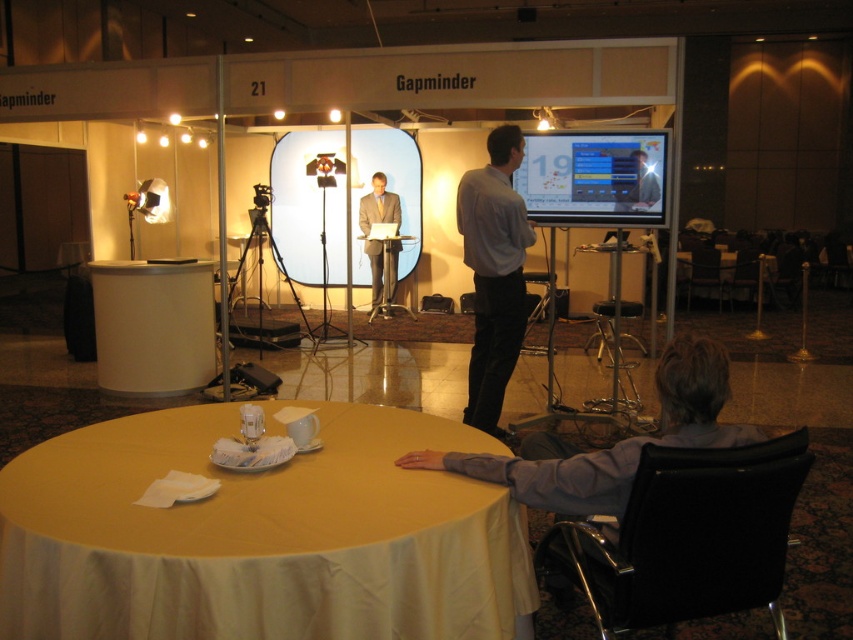
Does matte gray suit at center have a smaller size compared to matte black laptop at upper center?

Actually, matte gray suit at center might be larger than matte black laptop at upper center.

Does matte gray suit at center appear on the left side of matte black laptop at upper center?

Correct, you'll find matte gray suit at center to the left of matte black laptop at upper center.

At what (x,y) coordinates should I click in order to perform the action: click on matte gray suit at center. Please return your answer as a coordinate pair (x, y). The width and height of the screenshot is (853, 640). Looking at the image, I should click on (381, 268).

Where is `matte gray suit at center`? The height and width of the screenshot is (640, 853). matte gray suit at center is located at coordinates (381, 268).

Between yellow fabric-covered table at lower left and light blue shirt at center, which one has less height?

With less height is yellow fabric-covered table at lower left.

Does yellow fabric-covered table at lower left have a greater height compared to light blue shirt at center?

No, yellow fabric-covered table at lower left is not taller than light blue shirt at center.

Is point (521, 545) positioned behind point (503, 129)?

That is False.

In order to click on yellow fabric-covered table at lower left in this screenshot , I will do `click(259, 536)`.

Does matte plastic screen at upper center lie behind matte black laptop at upper center?

That is False.

Between matte plastic screen at upper center and matte black laptop at upper center, which one appears on the left side from the viewer's perspective?

Positioned to the left is matte plastic screen at upper center.

Does point (639, 138) come farther from viewer compared to point (637, 204)?

No, it is not.

Identify the location of matte plastic screen at upper center. This screenshot has height=640, width=853. (595, 177).